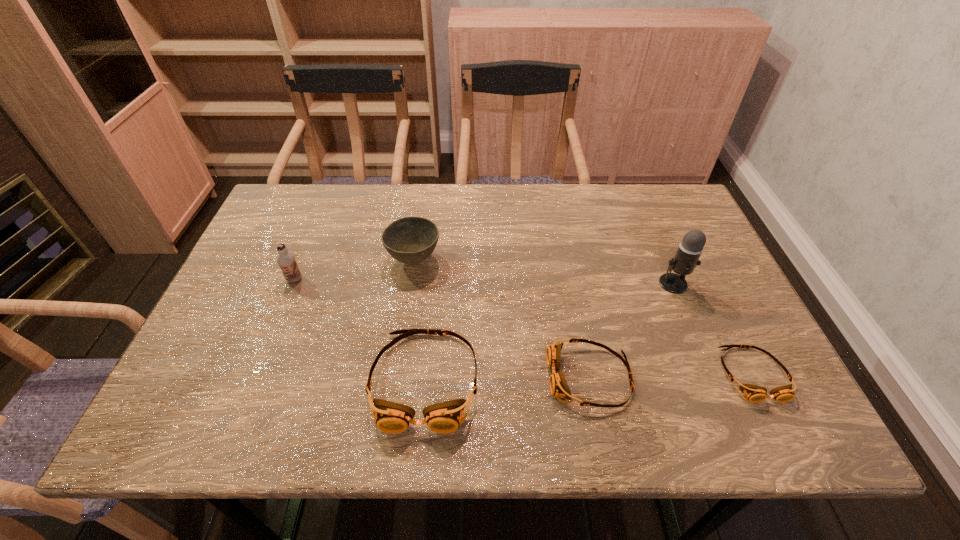
At what (x,y) coordinates should I click in order to perform the action: click on vacant area between the tallest object and the chocolate milk. Please return your answer as a coordinate pair (x, y). The image size is (960, 540). Looking at the image, I should click on (484, 281).

Where is `unoccupied area between the tallest object and the second tallest goggles`? unoccupied area between the tallest object and the second tallest goggles is located at coordinates (632, 330).

You are a GUI agent. You are given a task and a screenshot of the screen. Output one action in this format:
    pyautogui.click(x=<x>, y=<y>)
    Task: Click on the blank region between the third tallest object and the chocolate milk
    Image resolution: width=960 pixels, height=540 pixels.
    Given the screenshot: What is the action you would take?
    pyautogui.click(x=354, y=270)

In order to click on free spot between the bowl and the fourth object from left to right in this screenshot , I will do `click(502, 319)`.

You are a GUI agent. You are given a task and a screenshot of the screen. Output one action in this format:
    pyautogui.click(x=<x>, y=<y>)
    Task: Click on the free space between the second goggles from left to right and the third shortest object
    
    Given the screenshot: What is the action you would take?
    pyautogui.click(x=507, y=379)

Choose which object is the third nearest neighbor to the chocolate milk. Please provide its 2D coordinates. Your answer should be formatted as a tuple, i.e. [(x, y)], where the tuple contains the x and y coordinates of a point satisfying the conditions above.

[(559, 388)]

Identify which object is the fifth nearest to the shortest object. Please provide its 2D coordinates. Your answer should be formatted as a tuple, i.e. [(x, y)], where the tuple contains the x and y coordinates of a point satisfying the conditions above.

[(286, 260)]

Where is `goggles that stands as the second closest to the third shortest object`? The width and height of the screenshot is (960, 540). goggles that stands as the second closest to the third shortest object is located at coordinates (754, 393).

Identify which goggles is the closest to the tallest goggles. Please provide its 2D coordinates. Your answer should be formatted as a tuple, i.e. [(x, y)], where the tuple contains the x and y coordinates of a point satisfying the conditions above.

[(559, 388)]

The width and height of the screenshot is (960, 540). What are the coordinates of `free space that satisfies the following two spatial constraints: 1. with the lenses facing forward on the shortest object; 2. with the lenses facing forward on the fifth tallest object` in the screenshot? It's located at [x=754, y=377].